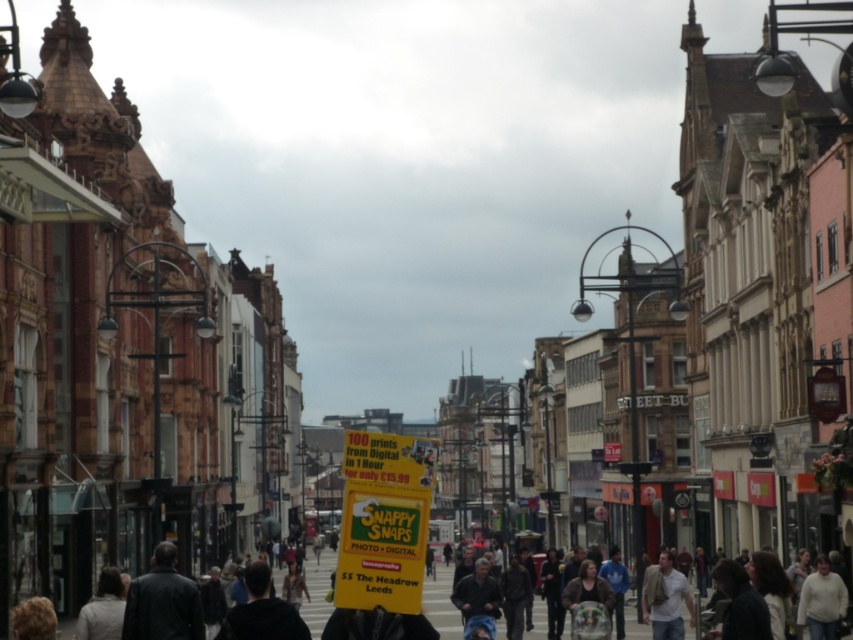
You are a photographer standing on the street in Leeds. You notice a yellow paper sign at center and a dark gray jacket at center. Which object is taller?

The yellow paper sign at center is much taller than the dark gray jacket at center.